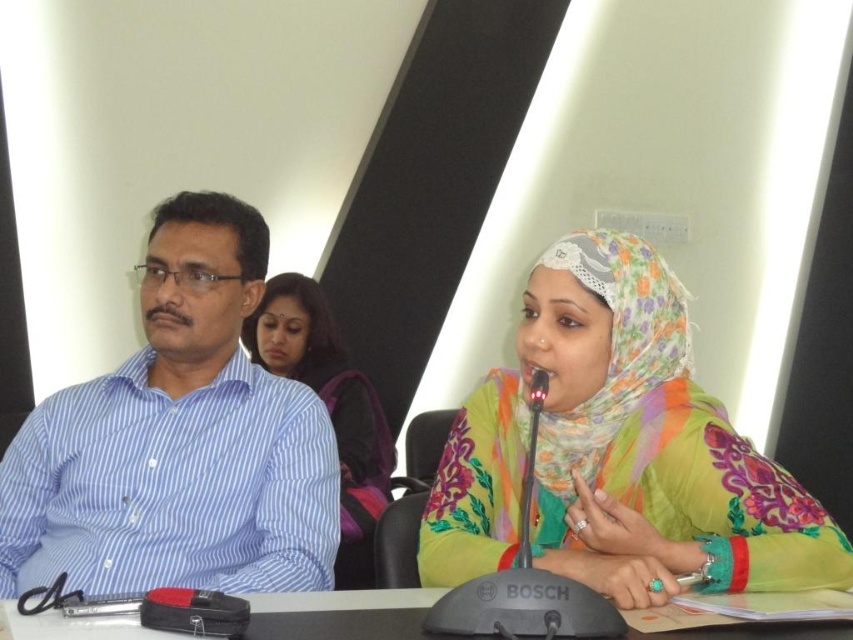
Question: Which object appears closest to the camera in this image?

Choices:
 (A) blue striped shirt at left
 (B) matte purple backpack at center
 (C) black plastic table at lower center

Answer: (C)

Question: Which of the following is the closest to the observer?

Choices:
 (A) (581, 474)
 (B) (349, 372)
 (C) (177, 266)

Answer: (A)

Question: Is blue striped shirt at left above black plastic table at lower center?

Choices:
 (A) yes
 (B) no

Answer: (A)

Question: Does blue striped shirt at left have a smaller size compared to black plastic table at lower center?

Choices:
 (A) yes
 (B) no

Answer: (B)

Question: Does matte purple backpack at center appear on the right side of black plastic table at lower center?

Choices:
 (A) no
 (B) yes

Answer: (A)

Question: Which of the following is the farthest from the observer?

Choices:
 (A) (49, 637)
 (B) (172, 241)
 (C) (265, 320)

Answer: (C)